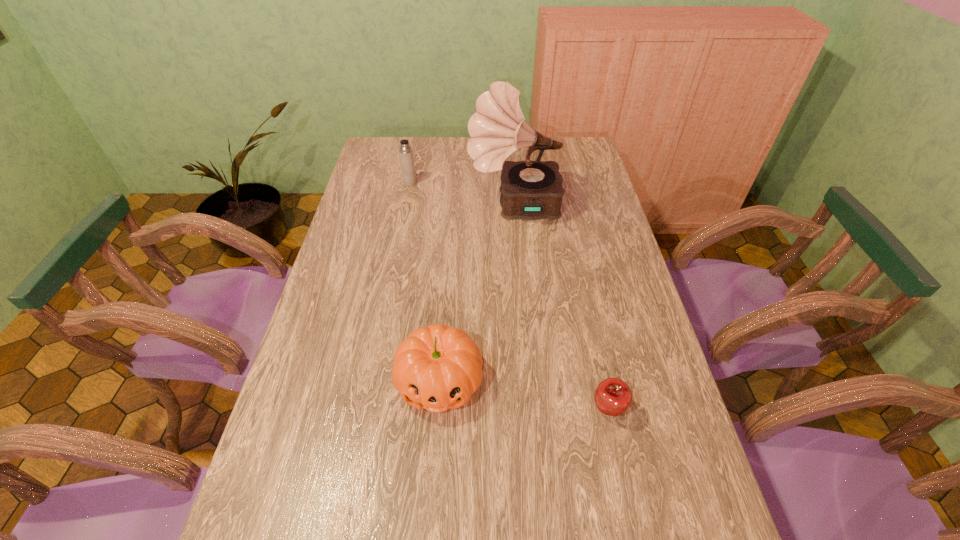
Find the location of `vacant space that's between the pumpkin and the record player`. vacant space that's between the pumpkin and the record player is located at coordinates (477, 293).

Identify the location of free space between the thermos bottle and the shortest object. (509, 296).

What are the coordinates of `unoccupied position between the apple and the third tallest object` in the screenshot? It's located at (523, 395).

I want to click on blank region between the second shortest object and the apple, so click(x=523, y=395).

Locate which object is the third closest to the third tallest object. Please provide its 2D coordinates. Your answer should be formatted as a tuple, i.e. [(x, y)], where the tuple contains the x and y coordinates of a point satisfying the conditions above.

[(405, 151)]

Identify which object is the second nearest to the thermos bottle. Please provide its 2D coordinates. Your answer should be formatted as a tuple, i.e. [(x, y)], where the tuple contains the x and y coordinates of a point satisfying the conditions above.

[(438, 367)]

This screenshot has height=540, width=960. What are the coordinates of `vacant region that satisfies the following two spatial constraints: 1. from the horn of the shortest object; 2. on the right side of the record player` in the screenshot? It's located at (533, 409).

Where is `free space that satisfies the following two spatial constraints: 1. on the front side of the apple; 2. on the left side of the thermos bottle`? The width and height of the screenshot is (960, 540). free space that satisfies the following two spatial constraints: 1. on the front side of the apple; 2. on the left side of the thermos bottle is located at coordinates (366, 409).

The width and height of the screenshot is (960, 540). What are the coordinates of `free space that satisfies the following two spatial constraints: 1. on the back side of the shortest object; 2. from the horn of the tallest object` in the screenshot? It's located at (564, 205).

This screenshot has width=960, height=540. What are the coordinates of `free spot that satisfies the following two spatial constraints: 1. on the carved face of the apple; 2. on the left side of the pumpkin` in the screenshot? It's located at (437, 409).